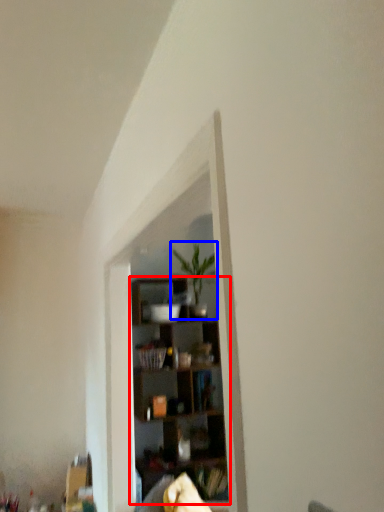
Question: Which object is closer to the camera taking this photo, shelf (highlighted by a red box) or houseplant (highlighted by a blue box)?

Choices:
 (A) shelf
 (B) houseplant

Answer: (A)